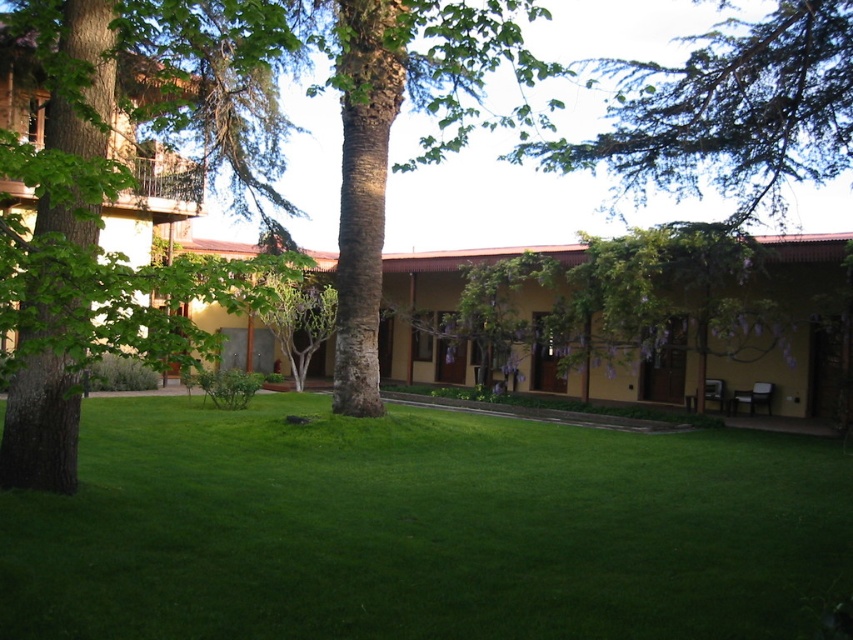
Describe the element at coordinates (126, 188) in the screenshot. I see `green leafy tree at left` at that location.

Where is `green leafy tree at left`? green leafy tree at left is located at coordinates (126, 188).

Who is lower down, green grass at center or green leafy tree at left?

green grass at center

This screenshot has height=640, width=853. What are the coordinates of `green grass at center` in the screenshot? It's located at (422, 529).

What do you see at coordinates (422, 529) in the screenshot? The height and width of the screenshot is (640, 853). I see `green grass at center` at bounding box center [422, 529].

Between point (71, 563) and point (677, 116), which one is positioned behind?

Positioned behind is point (677, 116).

Which is behind, point (73, 524) or point (790, 28)?

The point (790, 28) is more distant.

This screenshot has width=853, height=640. What are the coordinates of `green grass at center` in the screenshot? It's located at (422, 529).